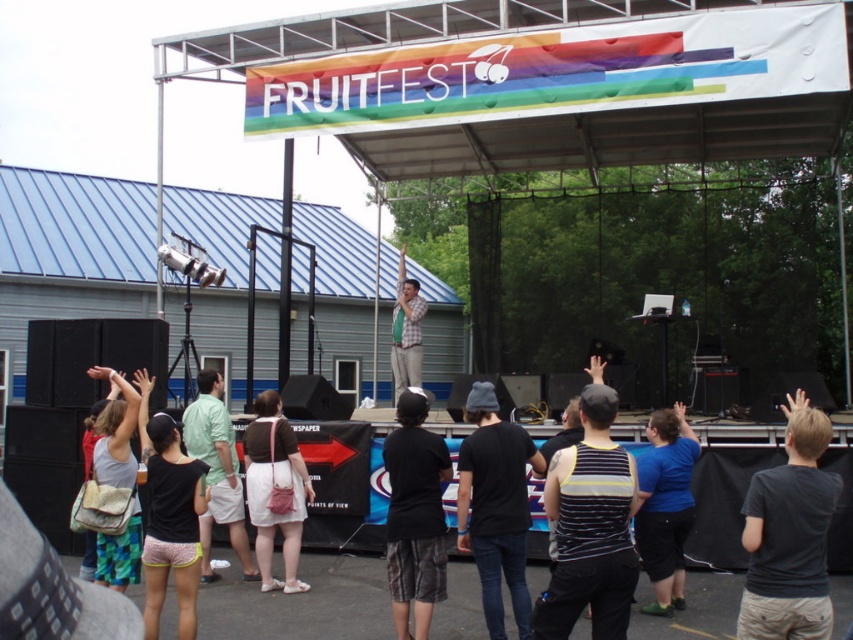
Question: Does black matte shirt at center appear over green shirt at center?

Choices:
 (A) no
 (B) yes

Answer: (A)

Question: Which point is farther to the camera?

Choices:
 (A) (281, 458)
 (B) (389, 589)

Answer: (A)

Question: Estimate the real-world distances between objects in this image. Which object is farther from the striped tank top at center?

Choices:
 (A) dark gray t-shirt at center
 (B) black cotton shirt at center
 (C) black matte shirt at center
 (D) green shirt at center

Answer: (D)

Question: From the image, what is the correct spatial relationship of black matte shirt at center in relation to black cotton shirt at center?

Choices:
 (A) above
 (B) below

Answer: (A)

Question: Is striped tank top at center wider than dark gray t-shirt at center?

Choices:
 (A) no
 (B) yes

Answer: (A)

Question: Which of the following is the farthest from the observer?

Choices:
 (A) (610, 404)
 (B) (283, 467)
 (C) (402, 384)

Answer: (C)